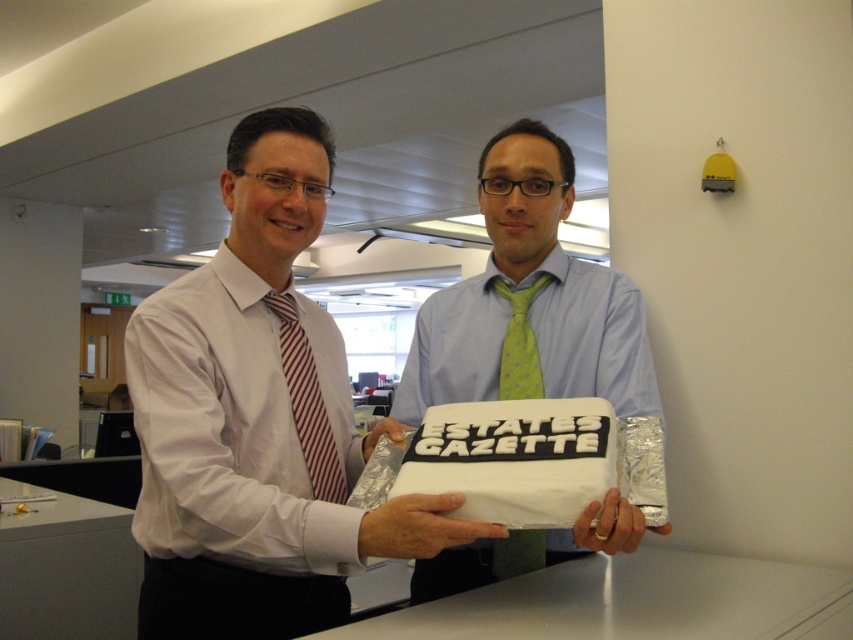
Question: Estimate the real-world distances between objects in this image. Which object is farther from the white matte cake at center?

Choices:
 (A) red striped tie at left
 (B) green dotted fabric tie at center
 (C) green dotted tie at center
 (D) white fondant cake at center

Answer: (B)

Question: Considering the relative positions of white matte cake at center and red striped tie at left in the image provided, where is white matte cake at center located with respect to red striped tie at left?

Choices:
 (A) below
 (B) above

Answer: (B)

Question: Does green dotted tie at center appear on the right side of white fondant cake at center?

Choices:
 (A) yes
 (B) no

Answer: (A)

Question: Is white matte cake at center below green dotted fabric tie at center?

Choices:
 (A) no
 (B) yes

Answer: (B)

Question: Which point is closer to the camera?

Choices:
 (A) (312, 365)
 (B) (498, 461)
 (C) (459, 570)
 (D) (433, 353)

Answer: (B)

Question: Which point is closer to the camera taking this photo?

Choices:
 (A) (614, 294)
 (B) (459, 392)

Answer: (A)